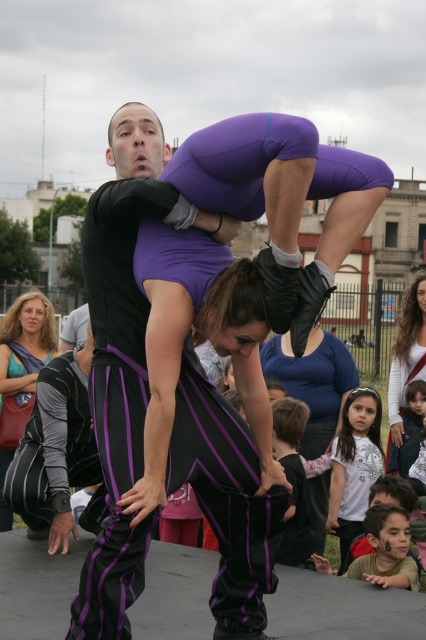
You are a photographer at the acrobatic performance. You want to capture the performer wearing the matte purple pants at center and the white cotton shirt at center in a single shot. Which clothing item will appear smaller in your photo?

The matte purple pants at center will appear smaller in the photo compared to the white cotton shirt at center because the matte purple pants at center has a smaller size.

Where is the matte purple pants at center located in the image?

The matte purple pants at center is located at point (25, 346) in the image.

You are a photographer at the event and want to capture a closeup of the matte black pants at center and the matte purple pants at center. Since your camera has a limited focus range, which pair of pants should you focus on to ensure they are in focus?

The matte black pants at center has a larger size compared to matte purple pants at center, so focusing on the matte black pants at center would ensure they are in focus since they are closer to the camera.